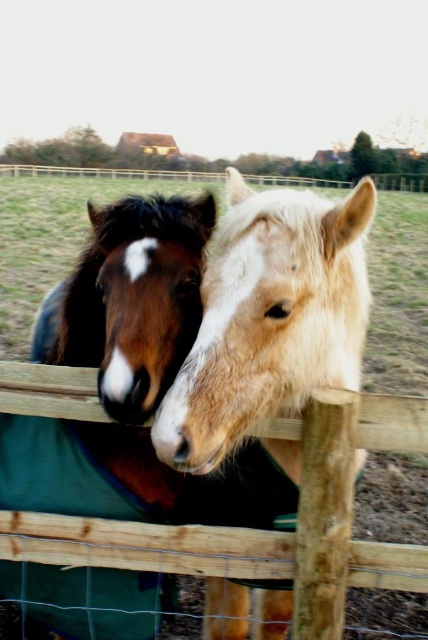
Does light brown fur at center have a larger size compared to wooden fence at center?

No, light brown fur at center is not bigger than wooden fence at center.

The image size is (428, 640). Describe the element at coordinates (270, 317) in the screenshot. I see `light brown fur at center` at that location.

Locate an element on the screen. The image size is (428, 640). light brown fur at center is located at coordinates (270, 317).

The width and height of the screenshot is (428, 640). I want to click on light brown fur at center, so click(x=270, y=317).